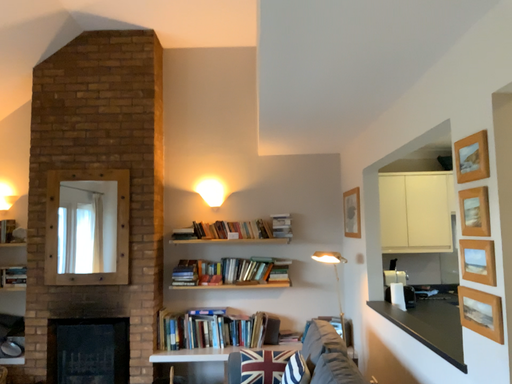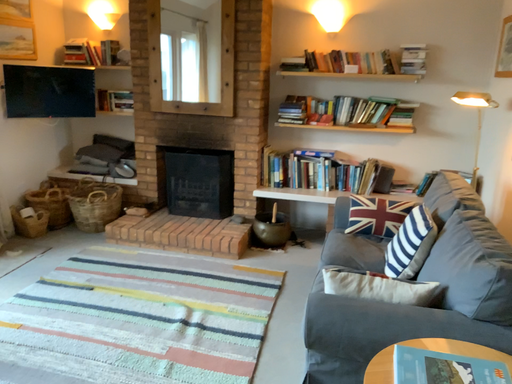
Question: Which way did the camera rotate in the video?

Choices:
 (A) rotated downward
 (B) rotated upward

Answer: (A)